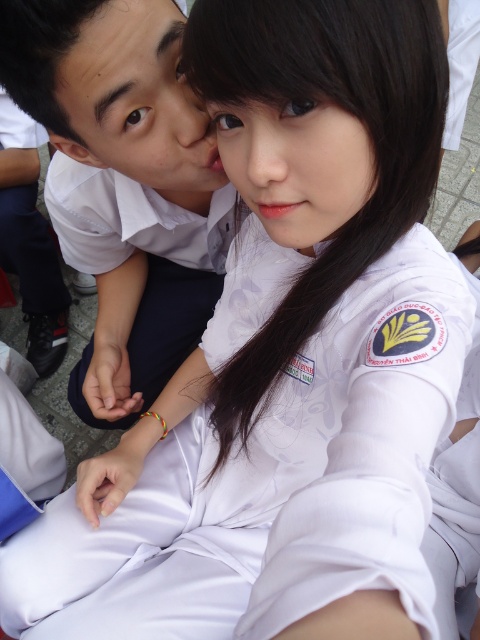
You are a photographer trying to capture a clear shot of both the white smooth shirt at upper left and the matte white face at upper left. Which object should you focus on first to ensure it fits entirely within your camera frame?

The white smooth shirt at upper left has a larger width than the matte white face at upper left, so you should focus on capturing the white smooth shirt at upper left first to ensure it fits entirely within your camera frame.

You are a photographer trying to adjust the lighting for a portrait. You need to place a spotlight at the position of the white smooth shirt at upper left. What are the coordinates where you should place the spotlight?

The coordinates for the white smooth shirt at upper left are at point [124,182]. Place the spotlight there.